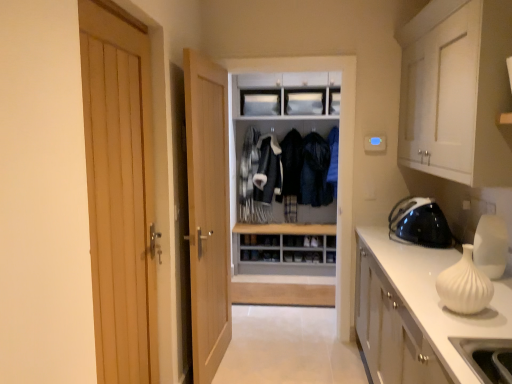
Question: Is light wood door at center, which is the 1th door in back-to-front order, positioned with its back to dark blue fabric jacket at center, which is the 1th clothing in left-to-right order?

Choices:
 (A) yes
 (B) no

Answer: (B)

Question: Is light wood door at center, marked as the second door in a front-to-back arrangement, in contact with dark blue fabric jacket at center, the 2th clothing from the right?

Choices:
 (A) no
 (B) yes

Answer: (A)

Question: Is light wood door at center, which is the 1th door in back-to-front order, taller than dark blue fabric jacket at center, which is the 1th clothing in left-to-right order?

Choices:
 (A) no
 (B) yes

Answer: (B)

Question: Can you confirm if light wood door at center, arranged as the 2th door when viewed from the left, is thinner than dark blue fabric jacket at center, which is the 1th clothing in left-to-right order?

Choices:
 (A) no
 (B) yes

Answer: (B)

Question: From the image's perspective, is light wood door at center, arranged as the 2th door when viewed from the left, on top of dark blue fabric jacket at center, which is the 1th clothing in left-to-right order?

Choices:
 (A) no
 (B) yes

Answer: (A)

Question: Can you confirm if light wood door at center, arranged as the 2th door when viewed from the left, is wider than dark blue fabric jacket at center, which is the 1th clothing in left-to-right order?

Choices:
 (A) no
 (B) yes

Answer: (A)

Question: From the image's perspective, is wooden door at left, marked as the first door in a front-to-back arrangement, beneath black glossy iron at right, the first appliance viewed from the back?

Choices:
 (A) no
 (B) yes

Answer: (B)

Question: From a real-world perspective, is wooden door at left, which ranks as the second door in back-to-front order, located beneath black glossy iron at right, the first appliance viewed from the back?

Choices:
 (A) yes
 (B) no

Answer: (B)

Question: Are wooden door at left, which ranks as the second door in back-to-front order, and black glossy iron at right, the first appliance viewed from the back, beside each other?

Choices:
 (A) yes
 (B) no

Answer: (B)

Question: Considering the relative sizes of wooden door at left, marked as the first door in a front-to-back arrangement, and black glossy iron at right, the 2th appliance viewed from the front, in the image provided, is wooden door at left, marked as the first door in a front-to-back arrangement, wider than black glossy iron at right, the 2th appliance viewed from the front,?

Choices:
 (A) no
 (B) yes

Answer: (A)

Question: Does wooden door at left, marked as the first door in a front-to-back arrangement, have a lesser height compared to black glossy iron at right, the 2th appliance viewed from the front?

Choices:
 (A) no
 (B) yes

Answer: (A)

Question: Could you tell me if wooden door at left, the second door from the right, is turned towards black glossy iron at right, the first appliance viewed from the back?

Choices:
 (A) yes
 (B) no

Answer: (B)

Question: From a real-world perspective, is dark blue fabric jacket at center, which is the 1th clothing in left-to-right order, over dark blue leather jacket at center, marked as the first clothing in a right-to-left arrangement?

Choices:
 (A) no
 (B) yes

Answer: (A)